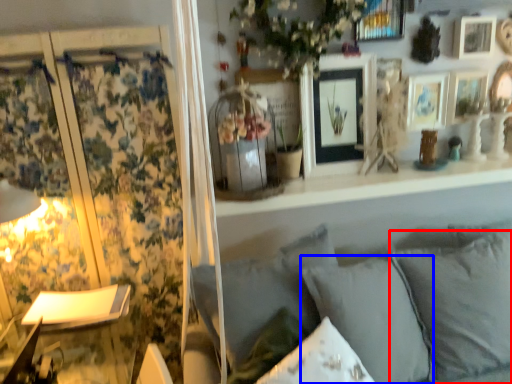
Question: Among these objects, which one is farthest to the camera, pillow (highlighted by a red box) or pillow (highlighted by a blue box)?

Choices:
 (A) pillow
 (B) pillow

Answer: (A)